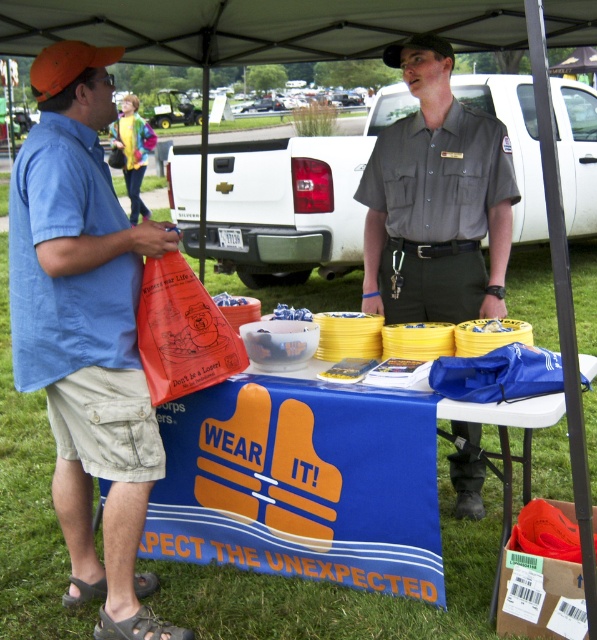
Can you confirm if blue fabric table at center is positioned above gray uniform at center?

No.

Does blue fabric table at center have a lesser height compared to gray uniform at center?

Indeed, blue fabric table at center has a lesser height compared to gray uniform at center.

Is point (509, 477) behind point (500, 227)?

That is False.

This screenshot has width=597, height=640. In order to click on blue fabric table at center in this screenshot , I will do `click(315, 480)`.

Which is below, white fabric canopy at upper center or orange fabric baseball cap at upper left?

orange fabric baseball cap at upper left is lower down.

In the scene shown: Does white fabric canopy at upper center appear over orange fabric baseball cap at upper left?

Yes.

Image resolution: width=597 pixels, height=640 pixels. What are the coordinates of `white fabric canopy at upper center` in the screenshot? It's located at (257, 28).

Is blue fabric table at center thinner than orange fabric baseball cap at upper left?

No, blue fabric table at center is not thinner than orange fabric baseball cap at upper left.

Does blue fabric table at center lie in front of orange fabric baseball cap at upper left?

Yes, it is in front of orange fabric baseball cap at upper left.

At what (x,y) coordinates should I click in order to perform the action: click on blue fabric table at center. Please return your answer as a coordinate pair (x, y). Looking at the image, I should click on (315, 480).